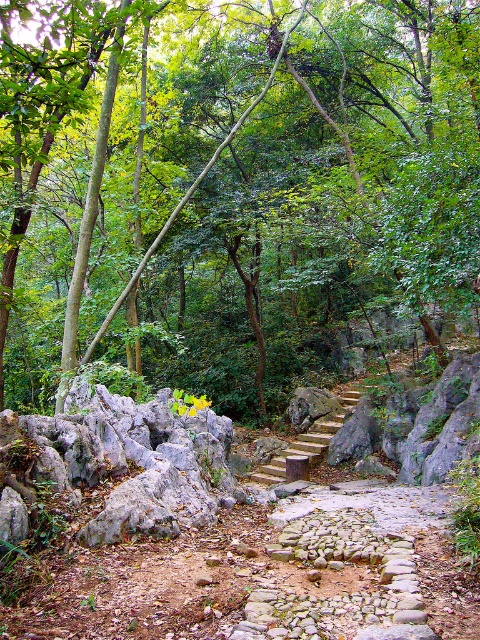
You are standing at the bottom of the wooden stairs at center in the forest. Looking upwards, do you see the green leafy tree at center above you?

Yes, the green leafy tree at center is above the wooden stairs at center, so you would see it when looking upwards.

You are a hiker trying to decide whether to take a photo of the green leafy tree at center or the wooden stairs at center. Which object should you choose if you want to capture something that is taller in the scene?

The green leafy tree at center is taller than the wooden stairs at center, so you should choose the green leafy tree at center to capture something taller in the scene.